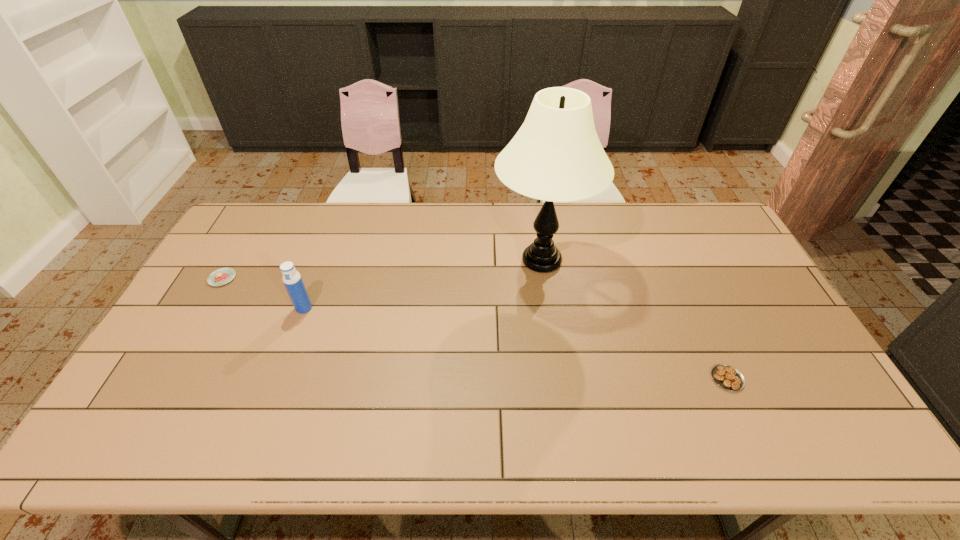
I want to click on the second object from right to left, so click(556, 156).

Locate an element on the screen. the tallest object is located at coordinates (556, 156).

Identify the location of the third object from right to left. (293, 282).

This screenshot has height=540, width=960. I want to click on the third farthest object, so click(293, 282).

Where is `the farther pastry`? The height and width of the screenshot is (540, 960). the farther pastry is located at coordinates (222, 276).

Find the location of `the leftmost object`. the leftmost object is located at coordinates (222, 276).

This screenshot has width=960, height=540. I want to click on the nearest object, so click(x=729, y=378).

The width and height of the screenshot is (960, 540). I want to click on the right pastry, so click(x=729, y=378).

Locate an element on the screen. This screenshot has width=960, height=540. vacant area situated on the left of the tallest object is located at coordinates (399, 260).

What are the coordinates of `vacant area situated on the right of the second tallest object` in the screenshot? It's located at (399, 308).